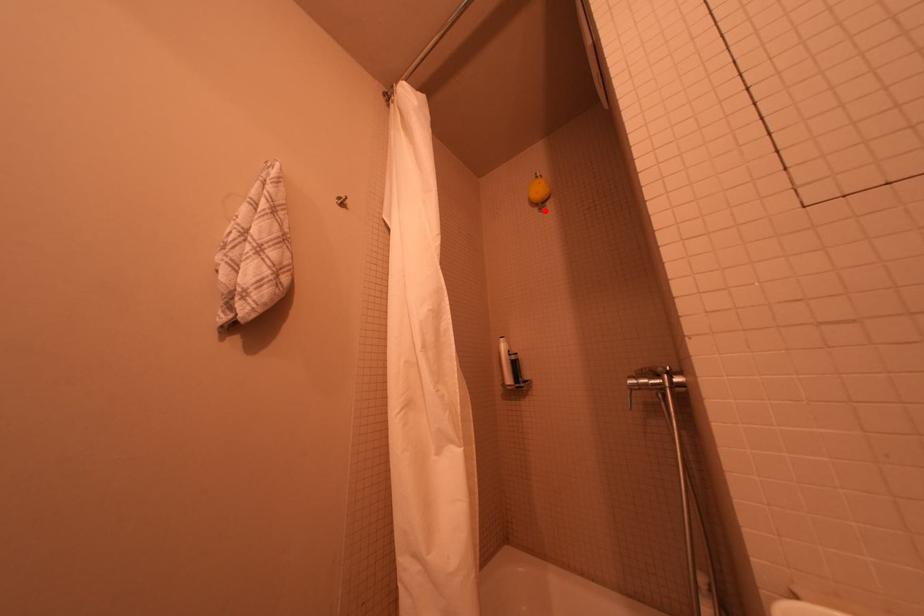
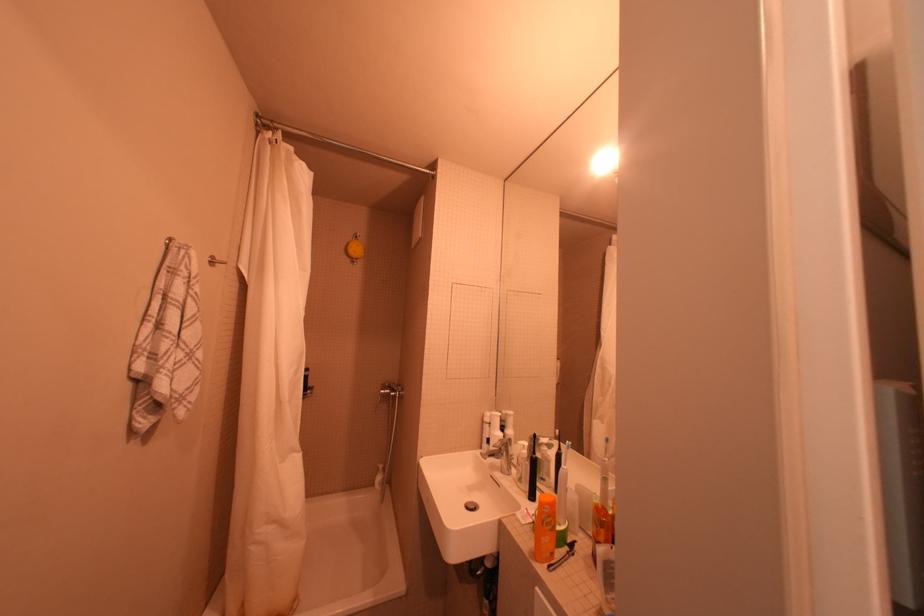
Question: I am providing you with two images of the same scene from different viewpoints. A red point is marked on the first image. At the location where the point appears in image 1, is it still visible in image 2?

Choices:
 (A) Yes
 (B) No

Answer: (A)